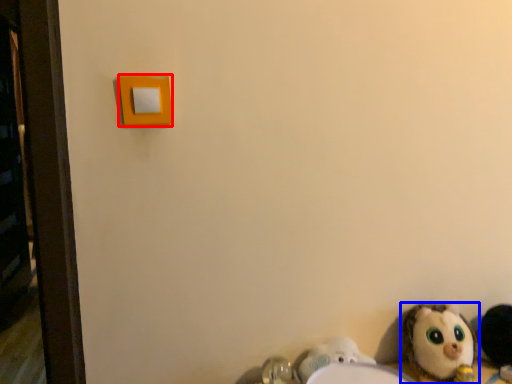
Question: Which object is further to the camera taking this photo, light switch (highlighted by a red box) or toy (highlighted by a blue box)?

Choices:
 (A) light switch
 (B) toy

Answer: (B)